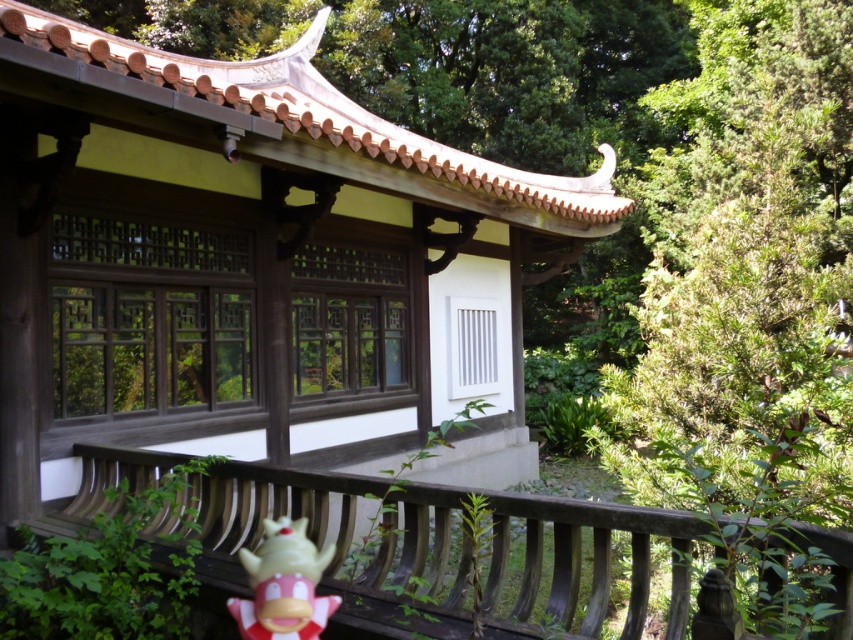
Can you confirm if smooth wooden balustrade at lower center is wider than plush yellow toy at lower center?

Correct, the width of smooth wooden balustrade at lower center exceeds that of plush yellow toy at lower center.

Between smooth wooden balustrade at lower center and plush yellow toy at lower center, which one appears on the right side from the viewer's perspective?

From the viewer's perspective, smooth wooden balustrade at lower center appears more on the right side.

What do you see at coordinates (341, 536) in the screenshot? I see `smooth wooden balustrade at lower center` at bounding box center [341, 536].

You are a GUI agent. You are given a task and a screenshot of the screen. Output one action in this format:
    pyautogui.click(x=<x>, y=<y>)
    Task: Click on the smooth wooden balustrade at lower center
    
    Given the screenshot: What is the action you would take?
    pyautogui.click(x=341, y=536)